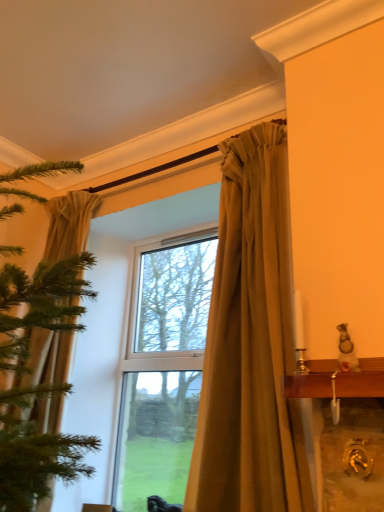
Question: Is matte gold curtain at center, which appears as the first curtain when viewed from the right, in front of or behind silky beige curtain at left, marked as the 2th curtain in a right-to-left arrangement, in the image?

Choices:
 (A) behind
 (B) front

Answer: (B)

Question: Considering the relative positions of matte gold curtain at center, which appears as the first curtain when viewed from the right, and silky beige curtain at left, which appears as the first curtain when viewed from the left, in the image provided, is matte gold curtain at center, which appears as the first curtain when viewed from the right, to the left or to the right of silky beige curtain at left, which appears as the first curtain when viewed from the left,?

Choices:
 (A) left
 (B) right

Answer: (B)

Question: From a real-world perspective, is matte gold curtain at center, the second curtain from the left, positioned above or below silky beige curtain at left, marked as the 2th curtain in a right-to-left arrangement?

Choices:
 (A) below
 (B) above

Answer: (B)

Question: Looking at their shapes, would you say silky beige curtain at left, marked as the 2th curtain in a right-to-left arrangement, is wider or thinner than matte gold curtain at center, the second curtain from the left?

Choices:
 (A) wide
 (B) thin

Answer: (A)

Question: In the image, is silky beige curtain at left, which appears as the first curtain when viewed from the left, on the left side or the right side of matte gold curtain at center, which appears as the first curtain when viewed from the right?

Choices:
 (A) left
 (B) right

Answer: (A)

Question: From the image's perspective, is silky beige curtain at left, which appears as the first curtain when viewed from the left, located above or below matte gold curtain at center, which appears as the first curtain when viewed from the right?

Choices:
 (A) above
 (B) below

Answer: (B)

Question: Based on their sizes in the image, would you say silky beige curtain at left, marked as the 2th curtain in a right-to-left arrangement, is bigger or smaller than matte gold curtain at center, which appears as the first curtain when viewed from the right?

Choices:
 (A) big
 (B) small

Answer: (A)